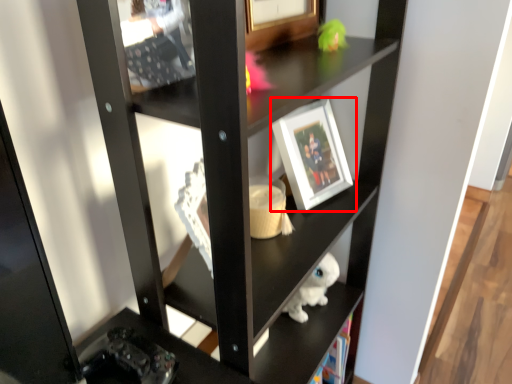
Question: From the image's perspective, considering the relative positions of picture frame (annotated by the red box) and shelf in the image provided, where is picture frame (annotated by the red box) located with respect to the staircase?

Choices:
 (A) above
 (B) below

Answer: (A)